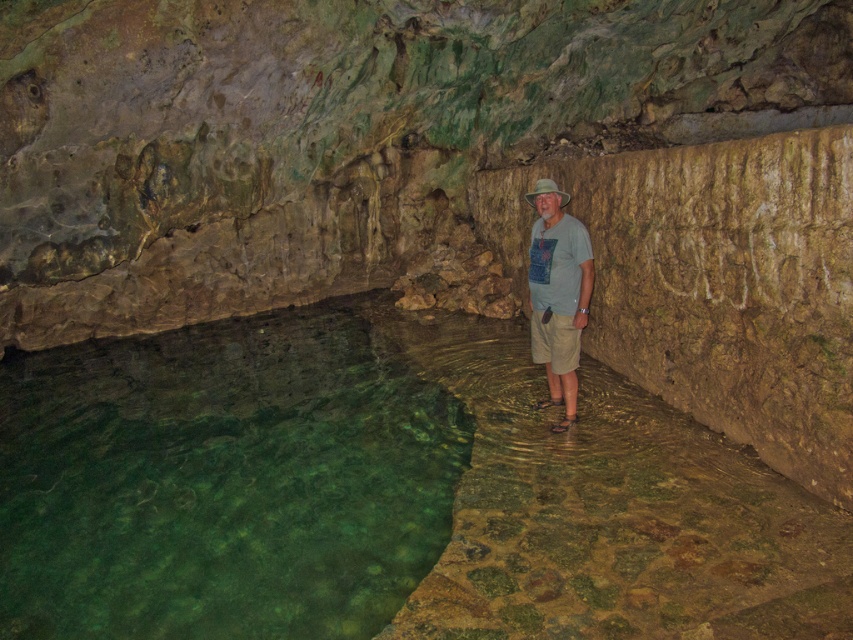
Question: Is green translucent water at lower left wider than light gray t-shirt at center?

Choices:
 (A) yes
 (B) no

Answer: (A)

Question: Which of the following is the farthest from the observer?

Choices:
 (A) light gray t-shirt at center
 (B) green translucent water at lower left

Answer: (B)

Question: Which point is closer to the camera taking this photo?

Choices:
 (A) (114, 627)
 (B) (566, 356)

Answer: (A)

Question: Among these points, which one is farthest from the camera?

Choices:
 (A) (555, 192)
 (B) (343, 547)

Answer: (A)

Question: Is the position of green translucent water at lower left more distant than that of light gray t-shirt at center?

Choices:
 (A) no
 (B) yes

Answer: (B)

Question: Is green translucent water at lower left closer to the viewer compared to light gray t-shirt at center?

Choices:
 (A) no
 (B) yes

Answer: (A)